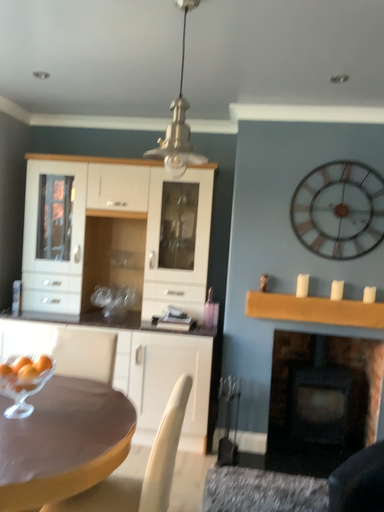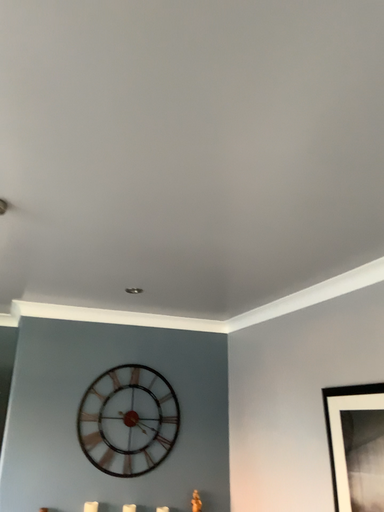
Question: Which way did the camera rotate in the video?

Choices:
 (A) rotated downward
 (B) rotated upward

Answer: (B)